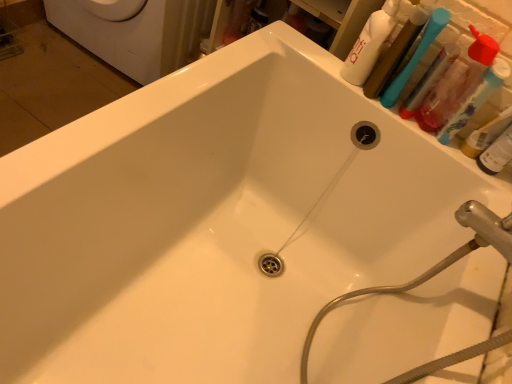
Question: Can you confirm if blue plastic toothbrush at upper right, which appears as the 2th toothbrush when viewed from the right, is shorter than brushed metal hose at upper right?

Choices:
 (A) yes
 (B) no

Answer: (A)

Question: From the image's perspective, would you say blue plastic toothbrush at upper right, which appears as the 2th toothbrush when viewed from the right, is shown under brushed metal hose at upper right?

Choices:
 (A) no
 (B) yes

Answer: (A)

Question: Is blue plastic toothbrush at upper right, which appears as the 2th toothbrush when viewed from the right, not close to brushed metal hose at upper right?

Choices:
 (A) no
 (B) yes

Answer: (A)

Question: Is blue plastic toothbrush at upper right, placed as the 1th toothbrush when sorted from left to right, oriented away from brushed metal hose at upper right?

Choices:
 (A) yes
 (B) no

Answer: (B)

Question: From a real-world perspective, does blue plastic toothbrush at upper right, which appears as the 2th toothbrush when viewed from the right, sit lower than brushed metal hose at upper right?

Choices:
 (A) no
 (B) yes

Answer: (A)

Question: Does blue plastic toothbrush at upper right, placed as the 1th toothbrush when sorted from left to right, have a smaller size compared to brushed metal hose at upper right?

Choices:
 (A) no
 (B) yes

Answer: (B)

Question: From the image's perspective, would you say blue plastic toothbrush at upper right, which appears as the 2th toothbrush when viewed from the right, is shown under white glossy washing machine at upper left?

Choices:
 (A) yes
 (B) no

Answer: (A)

Question: Is blue plastic toothbrush at upper right, placed as the 1th toothbrush when sorted from left to right, at the left side of white glossy washing machine at upper left?

Choices:
 (A) no
 (B) yes

Answer: (A)

Question: Is blue plastic toothbrush at upper right, which appears as the 2th toothbrush when viewed from the right, next to white glossy washing machine at upper left and touching it?

Choices:
 (A) yes
 (B) no

Answer: (B)

Question: Can you confirm if blue plastic toothbrush at upper right, which appears as the 2th toothbrush when viewed from the right, is bigger than white glossy washing machine at upper left?

Choices:
 (A) no
 (B) yes

Answer: (A)

Question: Is blue plastic toothbrush at upper right, placed as the 1th toothbrush when sorted from left to right, further to the viewer compared to white glossy washing machine at upper left?

Choices:
 (A) yes
 (B) no

Answer: (B)

Question: From a real-world perspective, is blue plastic toothbrush at upper right, placed as the 1th toothbrush when sorted from left to right, on top of white glossy washing machine at upper left?

Choices:
 (A) no
 (B) yes

Answer: (B)

Question: From a real-world perspective, is translucent plastic bottle at upper right located higher than white glossy bottle at upper right?

Choices:
 (A) no
 (B) yes

Answer: (A)